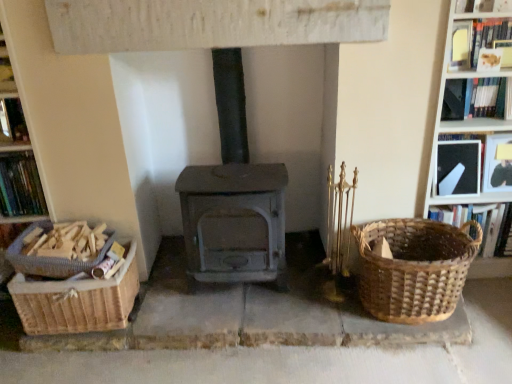
Identify the location of matte black book at upper right, the 1th book positioned from the right. (497, 163).

Where is `woven wood basket at left, which is the 1th basket in left-to-right order`? The image size is (512, 384). woven wood basket at left, which is the 1th basket in left-to-right order is located at coordinates (50, 257).

Locate an element on the screen. woven brown basket at lower left is located at coordinates (77, 301).

Locate an element on the screen. This screenshot has height=384, width=512. matte black book at upper right, which appears as the seventh book when viewed from the left is located at coordinates (497, 163).

From a real-world perspective, is matte black book at upper right, the 1th book positioned from the right, positioned under hardcover book at upper right, which is counted as the fourth book, starting from the left, based on gravity?

Correct, in the physical world, matte black book at upper right, the 1th book positioned from the right, is lower than hardcover book at upper right, which is counted as the fourth book, starting from the left.

You are a GUI agent. You are given a task and a screenshot of the screen. Output one action in this format:
    pyautogui.click(x=<x>, y=<y>)
    Task: Click on the 1st book in front of the matte black book at upper right, the 1th book positioned from the right
    Image resolution: width=512 pixels, height=384 pixels.
    Given the screenshot: What is the action you would take?
    pyautogui.click(x=475, y=98)

Which of these two, matte black book at upper right, the 1th book positioned from the right, or hardcover book at upper right, which is counted as the fourth book, starting from the left, is thinner?

matte black book at upper right, the 1th book positioned from the right.

Considering their positions, is matte black book at upper right, the 1th book positioned from the right, located in front of or behind hardcover book at upper right, which is counted as the fourth book, starting from the left?

Visually, matte black book at upper right, the 1th book positioned from the right, is located behind hardcover book at upper right, which is counted as the fourth book, starting from the left.

Can you confirm if black paper at upper right, the 3th book when ordered from right to left, is wider than hardcover books at left, which is counted as the 6th book, starting from the right?

No.

Is point (443, 158) more distant than point (31, 154)?

Yes, point (443, 158) is behind point (31, 154).

From a real-world perspective, which book is the 1st one underneath the hardcover books at left, placed as the second book when sorted from left to right? Please provide its 2D coordinates.

[(473, 166)]

Considering the positions of objects black paper at upper right, placed as the 5th book when sorted from left to right, and hardcover books at left, which is counted as the 6th book, starting from the right, in the image provided, who is behind, black paper at upper right, placed as the 5th book when sorted from left to right, or hardcover books at left, which is counted as the 6th book, starting from the right,?

black paper at upper right, placed as the 5th book when sorted from left to right, is further away from the camera.

Is hardcover book at upper left, the 1th book when ordered from left to right, to the right of brown woven basket at right, the second basket viewed from the left, from the viewer's perspective?

Incorrect, hardcover book at upper left, the 1th book when ordered from left to right, is not on the right side of brown woven basket at right, the second basket viewed from the left.

From the image's perspective, is hardcover book at upper left, the 1th book when ordered from left to right, located above brown woven basket at right, which is the 1th basket in right-to-left order?

Yes, from the image's perspective, hardcover book at upper left, the 1th book when ordered from left to right, is over brown woven basket at right, which is the 1th basket in right-to-left order.

Is hardcover book at upper left, which is the 7th book in right-to-left order, in front of brown woven basket at right, the second basket viewed from the left?

No, it is not.

Between matte black book at upper right, the 1th book positioned from the right, and gray matte wood burning stove at center, which one has larger width?

gray matte wood burning stove at center is wider.

Is matte black book at upper right, which appears as the seventh book when viewed from the left, to the left of gray matte wood burning stove at center from the viewer's perspective?

In fact, matte black book at upper right, which appears as the seventh book when viewed from the left, is to the right of gray matte wood burning stove at center.

Considering the relative sizes of matte black book at upper right, the 1th book positioned from the right, and gray matte wood burning stove at center in the image provided, is matte black book at upper right, the 1th book positioned from the right, smaller than gray matte wood burning stove at center?

Yes, matte black book at upper right, the 1th book positioned from the right, is smaller than gray matte wood burning stove at center.

Is point (494, 156) closer to viewer compared to point (202, 210)?

No, it is behind (202, 210).

How many degrees apart are the facing directions of gray matte wood burning stove at center and brown woven basket at right, which is the 1th basket in right-to-left order?

The facing directions of gray matte wood burning stove at center and brown woven basket at right, which is the 1th basket in right-to-left order, are 0.976 degrees apart.

From the image's perspective, is gray matte wood burning stove at center over brown woven basket at right, the second basket viewed from the left?

Yes, from the image's perspective, gray matte wood burning stove at center is over brown woven basket at right, the second basket viewed from the left.

From their relative heights in the image, would you say gray matte wood burning stove at center is taller or shorter than brown woven basket at right, the second basket viewed from the left?

Clearly, gray matte wood burning stove at center is taller compared to brown woven basket at right, the second basket viewed from the left.

Is brown woven basket at right, which is the 1th basket in right-to-left order, a part of gray matte wood burning stove at center?

Actually, brown woven basket at right, which is the 1th basket in right-to-left order, is outside gray matte wood burning stove at center.

In terms of height, does hardcover book at upper right, placed as the third book when sorted from left to right, look taller or shorter compared to woven brown basket at lower left?

Clearly, hardcover book at upper right, placed as the third book when sorted from left to right, is shorter compared to woven brown basket at lower left.

From a real-world perspective, who is located lower, hardcover book at upper right, positioned as the 5th book in right-to-left order, or woven brown basket at lower left?

From a 3D spatial view, woven brown basket at lower left is below.

From a real-world perspective, is hardcover book at upper right, which is counted as the fourth book, starting from the left, on top of hardcover book at upper right, placed as the third book when sorted from left to right?

Incorrect, from a real-world perspective, hardcover book at upper right, which is counted as the fourth book, starting from the left, is lower than hardcover book at upper right, placed as the third book when sorted from left to right.

Is hardcover book at upper right, the fourth book in the right-to-left sequence, wider than hardcover book at upper right, positioned as the 5th book in right-to-left order?

No, hardcover book at upper right, the fourth book in the right-to-left sequence, is not wider than hardcover book at upper right, positioned as the 5th book in right-to-left order.

This screenshot has width=512, height=384. I want to click on the 3rd book behind the hardcover book at upper right, positioned as the 5th book in right-to-left order, so pos(475,98).

From the image's perspective, relative to hardcover book at upper right, positioned as the 5th book in right-to-left order, is hardcover book at upper right, the fourth book in the right-to-left sequence, above or below?

hardcover book at upper right, the fourth book in the right-to-left sequence, is below hardcover book at upper right, positioned as the 5th book in right-to-left order.

Which book is the 1st one when counting from the front of the matte black book at upper right, which appears as the seventh book when viewed from the left? Please provide its 2D coordinates.

[(475, 98)]

Locate an element on the screen. This screenshot has height=384, width=512. the 4th book behind the hardcover books at left, which is counted as the 6th book, starting from the right is located at coordinates (473, 166).

Based on their spatial positions, is woven basket at right, positioned as the 6th book in left-to-right order, or woven wood basket at left, which is the 1th basket in left-to-right order, further from black paper at upper right, placed as the 5th book when sorted from left to right?

woven wood basket at left, which is the 1th basket in left-to-right order.

Looking at this image, when comparing their distances from woven basket at right, positioned as the 6th book in left-to-right order, does hardcover books at left, placed as the second book when sorted from left to right, or woven brown basket at lower left seem further?

hardcover books at left, placed as the second book when sorted from left to right, is further to woven basket at right, positioned as the 6th book in left-to-right order.

From the image, which object appears to be nearer to gray matte wood burning stove at center, black paper at upper right, the 3th book when ordered from right to left, or hardcover books at left, which is counted as the 6th book, starting from the right?

hardcover books at left, which is counted as the 6th book, starting from the right.

Looking at this image, which object lies nearer to the anchor point hardcover book at upper left, the 1th book when ordered from left to right, woven wood basket at left, which is the second basket from right to left, or woven basket at right, which is the second book from right to left?

woven wood basket at left, which is the second basket from right to left, is positioned closer to the anchor hardcover book at upper left, the 1th book when ordered from left to right.

Looking at this image, when comparing their distances from brown woven basket at right, the second basket viewed from the left, does hardcover books at left, placed as the second book when sorted from left to right, or woven basket at right, positioned as the 6th book in left-to-right order, seem further?

Among the two, hardcover books at left, placed as the second book when sorted from left to right, is located further to brown woven basket at right, the second basket viewed from the left.

From the image, which object appears to be nearer to woven basket at right, positioned as the 6th book in left-to-right order, matte black book at upper right, the 1th book positioned from the right, or black paper at upper right, placed as the 5th book when sorted from left to right?

black paper at upper right, placed as the 5th book when sorted from left to right, lies closer to woven basket at right, positioned as the 6th book in left-to-right order, than the other object.

Estimate the real-world distances between objects in this image. Which object is further from hardcover book at upper left, the 1th book when ordered from left to right, matte black book at upper right, which appears as the seventh book when viewed from the left, or brown woven basket at right, the second basket viewed from the left?

Among the two, matte black book at upper right, which appears as the seventh book when viewed from the left, is located further to hardcover book at upper left, the 1th book when ordered from left to right.

Looking at the image, which one is located further to woven basket at right, which is the second book from right to left, hardcover book at upper right, placed as the third book when sorted from left to right, or gray matte wood burning stove at center?

Based on the image, gray matte wood burning stove at center appears to be further to woven basket at right, which is the second book from right to left.

Where is `wood burning stove situated between hardcover book at upper left, which is the 7th book in right-to-left order, and black paper at upper right, the 3th book when ordered from right to left, from left to right`? Image resolution: width=512 pixels, height=384 pixels. wood burning stove situated between hardcover book at upper left, which is the 7th book in right-to-left order, and black paper at upper right, the 3th book when ordered from right to left, from left to right is located at coordinates (234, 197).

Where is `basket container between hardcover book at upper left, the 1th book when ordered from left to right, and brown woven basket at right, the second basket viewed from the left, from left to right`? basket container between hardcover book at upper left, the 1th book when ordered from left to right, and brown woven basket at right, the second basket viewed from the left, from left to right is located at coordinates (77, 301).

This screenshot has width=512, height=384. Identify the location of basket container situated between hardcover book at upper left, which is the 7th book in right-to-left order, and woven basket at right, positioned as the 6th book in left-to-right order, from left to right. (77, 301).

You are a GUI agent. You are given a task and a screenshot of the screen. Output one action in this format:
    pyautogui.click(x=<x>, y=<y>)
    Task: Click on the basket located between gray matte wood burning stove at center and black paper at upper right, the 3th book when ordered from right to left, in the left-right direction
    
    Given the screenshot: What is the action you would take?
    pyautogui.click(x=414, y=268)